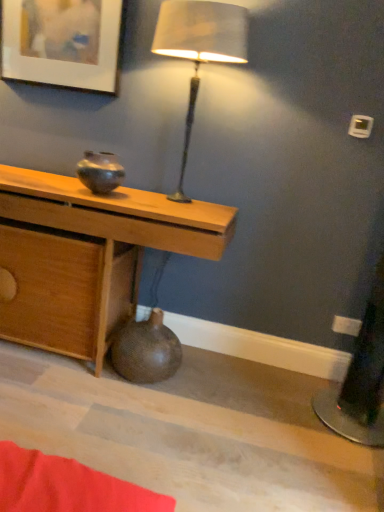
What do you see at coordinates (199, 48) in the screenshot? I see `satin beige lampshade at upper center` at bounding box center [199, 48].

Locate an element on the screen. Image resolution: width=384 pixels, height=512 pixels. shiny metallic vase at center, placed as the first vase when sorted from top to bottom is located at coordinates click(100, 172).

Where is `matte white picture frame at upper left`? matte white picture frame at upper left is located at coordinates (62, 42).

What do you see at coordinates (88, 256) in the screenshot? The image size is (384, 512). I see `wooden desk at center` at bounding box center [88, 256].

In order to click on brown textured vase at lower center, placed as the first vase when sorted from bottom to top in this screenshot , I will do `click(146, 350)`.

What do you see at coordinates (146, 350) in the screenshot?
I see `brown textured vase at lower center, which is counted as the second vase, starting from the top` at bounding box center [146, 350].

This screenshot has height=512, width=384. Identify the location of satin beige lampshade at upper center. (199, 48).

From a real-world perspective, is matte white picture frame at upper left physically located above or below shiny metallic vase at center, the second vase when ordered from bottom to top?

In terms of real-world spatial position, matte white picture frame at upper left is above shiny metallic vase at center, the second vase when ordered from bottom to top.

Where is `picture frame that appears on the left of shiny metallic vase at center, placed as the first vase when sorted from top to bottom`? Image resolution: width=384 pixels, height=512 pixels. picture frame that appears on the left of shiny metallic vase at center, placed as the first vase when sorted from top to bottom is located at coordinates (62, 42).

Can you confirm if matte white picture frame at upper left is taller than shiny metallic vase at center, the second vase when ordered from bottom to top?

Correct, matte white picture frame at upper left is much taller as shiny metallic vase at center, the second vase when ordered from bottom to top.

Is matte white picture frame at upper left in front of or behind shiny metallic vase at center, placed as the first vase when sorted from top to bottom, in the image?

matte white picture frame at upper left is positioned farther from the viewer than shiny metallic vase at center, placed as the first vase when sorted from top to bottom.

Does point (91, 182) come behind point (227, 38)?

That is True.

Based on the photo, measure the distance from shiny metallic vase at center, the second vase when ordered from bottom to top, to satin beige lampshade at upper center.

shiny metallic vase at center, the second vase when ordered from bottom to top, is 57.36 centimeters from satin beige lampshade at upper center.

Can you confirm if shiny metallic vase at center, the second vase when ordered from bottom to top, is wider than satin beige lampshade at upper center?

No, shiny metallic vase at center, the second vase when ordered from bottom to top, is not wider than satin beige lampshade at upper center.

Can you tell me how much shiny metallic vase at center, placed as the first vase when sorted from top to bottom, and satin beige lampshade at upper center differ in facing direction?

shiny metallic vase at center, placed as the first vase when sorted from top to bottom, and satin beige lampshade at upper center are facing 3.87 degrees away from each other.

Would you say wooden desk at center is inside or outside brown textured vase at lower center, placed as the first vase when sorted from bottom to top?

The correct answer is: outside.

From the image's perspective, is wooden desk at center above or below brown textured vase at lower center, which is counted as the second vase, starting from the top?

Clearly, from the image's perspective, wooden desk at center is above brown textured vase at lower center, which is counted as the second vase, starting from the top.

From a real-world perspective, who is located lower, wooden desk at center or brown textured vase at lower center, which is counted as the second vase, starting from the top?

brown textured vase at lower center, which is counted as the second vase, starting from the top, is physically lower.

The height and width of the screenshot is (512, 384). In order to click on desk that is above the brown textured vase at lower center, placed as the first vase when sorted from bottom to top (from the image's perspective) in this screenshot , I will do `click(88, 256)`.

Considering the relative positions of satin beige lampshade at upper center and matte white picture frame at upper left in the image provided, is satin beige lampshade at upper center behind matte white picture frame at upper left?

No, it is not.

Where is `picture frame above the satin beige lampshade at upper center (from a real-world perspective)`? picture frame above the satin beige lampshade at upper center (from a real-world perspective) is located at coordinates (62, 42).

From the image's perspective, is satin beige lampshade at upper center positioned above or below matte white picture frame at upper left?

satin beige lampshade at upper center is situated lower than matte white picture frame at upper left in the image.

From a real-world perspective, is satin beige lampshade at upper center on matte white picture frame at upper left?

No, from a real-world perspective, satin beige lampshade at upper center is not above matte white picture frame at upper left.

Who is more distant, matte white picture frame at upper left or brown textured vase at lower center, placed as the first vase when sorted from bottom to top?

matte white picture frame at upper left is further from the camera.

Which is closer, (90,69) or (126,326)?

The point (90,69) is more forward.

Is matte white picture frame at upper left to the left or to the right of brown textured vase at lower center, placed as the first vase when sorted from bottom to top, in the image?

Based on their positions, matte white picture frame at upper left is located to the left of brown textured vase at lower center, placed as the first vase when sorted from bottom to top.

Where is `picture frame positioned vertically above the brown textured vase at lower center, placed as the first vase when sorted from bottom to top (from a real-world perspective)`? Image resolution: width=384 pixels, height=512 pixels. picture frame positioned vertically above the brown textured vase at lower center, placed as the first vase when sorted from bottom to top (from a real-world perspective) is located at coordinates (62, 42).

From a real-world perspective, is brown textured vase at lower center, placed as the first vase when sorted from bottom to top, under matte white picture frame at upper left?

Yes, from a real-world perspective, brown textured vase at lower center, placed as the first vase when sorted from bottom to top, is beneath matte white picture frame at upper left.

Is brown textured vase at lower center, placed as the first vase when sorted from bottom to top, oriented away from matte white picture frame at upper left?

No, matte white picture frame at upper left is not at the back of brown textured vase at lower center, placed as the first vase when sorted from bottom to top.

From the image's perspective, would you say brown textured vase at lower center, which is counted as the second vase, starting from the top, is positioned over matte white picture frame at upper left?

No, from the image's perspective, brown textured vase at lower center, which is counted as the second vase, starting from the top, is not on top of matte white picture frame at upper left.

Could you tell me if satin beige lampshade at upper center is turned towards brown textured vase at lower center, which is counted as the second vase, starting from the top?

No, satin beige lampshade at upper center does not turn towards brown textured vase at lower center, which is counted as the second vase, starting from the top.

Is point (243, 28) more distant than point (136, 377)?

No, (243, 28) is closer to viewer.

From the image's perspective, which one is positioned higher, satin beige lampshade at upper center or brown textured vase at lower center, placed as the first vase when sorted from bottom to top?

From the image's view, satin beige lampshade at upper center is above.

Considering the relative sizes of satin beige lampshade at upper center and brown textured vase at lower center, placed as the first vase when sorted from bottom to top, in the image provided, is satin beige lampshade at upper center smaller than brown textured vase at lower center, placed as the first vase when sorted from bottom to top,?

Actually, satin beige lampshade at upper center might be larger than brown textured vase at lower center, placed as the first vase when sorted from bottom to top.

Identify the location of the 1st vase positioned below the matte white picture frame at upper left (from a real-world perspective). The height and width of the screenshot is (512, 384). (100, 172).

From the satin beige lampshade at upper center, count 1st vases backward and point to it. Please provide its 2D coordinates.

[(100, 172)]

From the image, which object appears to be farther from satin beige lampshade at upper center, wooden desk at center or matte white picture frame at upper left?

wooden desk at center is further to satin beige lampshade at upper center.

Which object lies nearer to the anchor point shiny metallic vase at center, placed as the first vase when sorted from top to bottom, matte white picture frame at upper left or wooden desk at center?

wooden desk at center is closer to shiny metallic vase at center, placed as the first vase when sorted from top to bottom.

From the image, which object appears to be farther from satin beige lampshade at upper center, matte white picture frame at upper left or shiny metallic vase at center, placed as the first vase when sorted from top to bottom?

shiny metallic vase at center, placed as the first vase when sorted from top to bottom, is positioned further to the anchor satin beige lampshade at upper center.

Which object lies nearer to the anchor point shiny metallic vase at center, the second vase when ordered from bottom to top, wooden desk at center or satin beige lampshade at upper center?

wooden desk at center lies closer to shiny metallic vase at center, the second vase when ordered from bottom to top, than the other object.

When comparing their distances from brown textured vase at lower center, placed as the first vase when sorted from bottom to top, does satin beige lampshade at upper center or shiny metallic vase at center, the second vase when ordered from bottom to top, seem further?

satin beige lampshade at upper center.

Estimate the real-world distances between objects in this image. Which object is closer to shiny metallic vase at center, placed as the first vase when sorted from top to bottom, matte white picture frame at upper left or brown textured vase at lower center, placed as the first vase when sorted from bottom to top?

matte white picture frame at upper left lies closer to shiny metallic vase at center, placed as the first vase when sorted from top to bottom, than the other object.

From the image, which object appears to be farther from wooden desk at center, satin beige lampshade at upper center or brown textured vase at lower center, placed as the first vase when sorted from bottom to top?

satin beige lampshade at upper center is further to wooden desk at center.

When comparing their distances from brown textured vase at lower center, placed as the first vase when sorted from bottom to top, does shiny metallic vase at center, the second vase when ordered from bottom to top, or matte white picture frame at upper left seem closer?

Among the two, shiny metallic vase at center, the second vase when ordered from bottom to top, is located nearer to brown textured vase at lower center, placed as the first vase when sorted from bottom to top.

The width and height of the screenshot is (384, 512). Identify the location of desk between satin beige lampshade at upper center and brown textured vase at lower center, which is counted as the second vase, starting from the top, in the vertical direction. (88, 256).

I want to click on vase between satin beige lampshade at upper center and wooden desk at center in the vertical direction, so click(x=100, y=172).

Where is `lamp between matte white picture frame at upper left and brown textured vase at lower center, which is counted as the second vase, starting from the top, from top to bottom`? lamp between matte white picture frame at upper left and brown textured vase at lower center, which is counted as the second vase, starting from the top, from top to bottom is located at coordinates (199, 48).

Where is `lamp between matte white picture frame at upper left and shiny metallic vase at center, the second vase when ordered from bottom to top, vertically`? lamp between matte white picture frame at upper left and shiny metallic vase at center, the second vase when ordered from bottom to top, vertically is located at coordinates (199, 48).